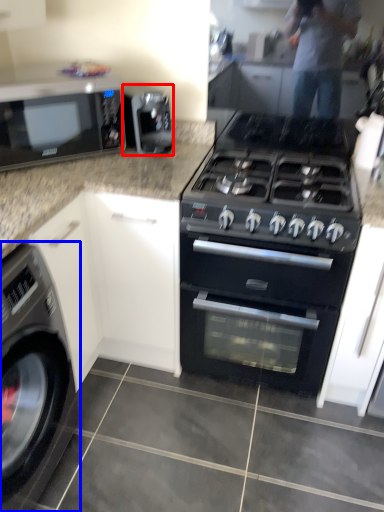
Question: Which object appears farthest to the camera in this image, appliance (highlighted by a red box) or washing machine (highlighted by a blue box)?

Choices:
 (A) appliance
 (B) washing machine

Answer: (A)